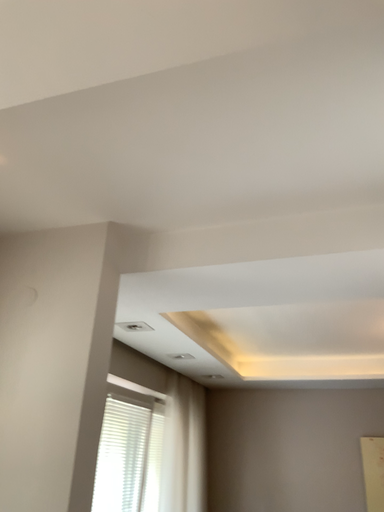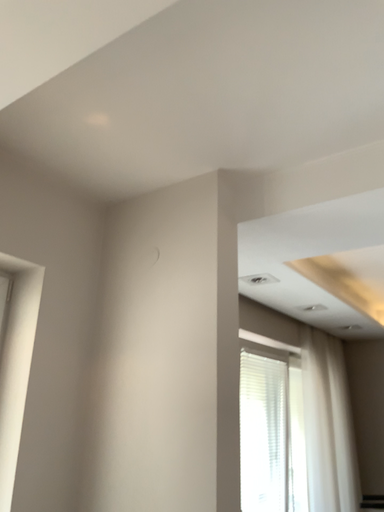
Question: Which way did the camera rotate in the video?

Choices:
 (A) rotated right
 (B) rotated left

Answer: (B)